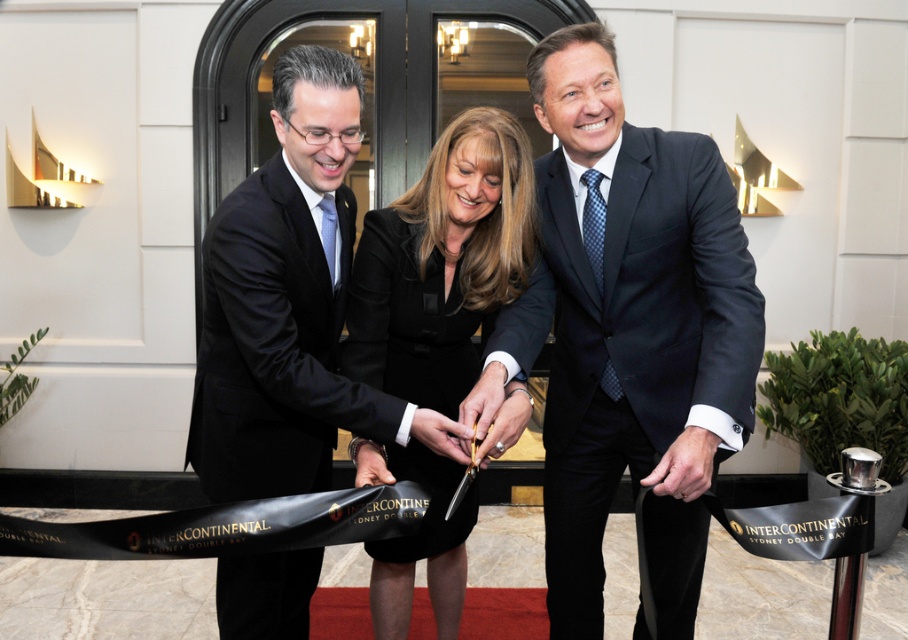
Can you confirm if black silk dress at center is positioned below black satin suit at center?

No.

Is point (624, 253) positioned before point (272, 177)?

No, it is behind (272, 177).

Identify the location of black silk dress at center. This screenshot has width=908, height=640. (637, 330).

Is the position of dark blue textured suit at center less distant than that of black satin dress at center?

Yes, it is.

Does dark blue textured suit at center have a greater width compared to black satin dress at center?

Indeed, dark blue textured suit at center has a greater width compared to black satin dress at center.

Which is behind, point (607, 282) or point (438, 294)?

The point (438, 294) is behind.

I want to click on dark blue textured suit at center, so click(637, 337).

In the scene shown: Is black silk dress at center smaller than dark blue textured suit at center?

Actually, black silk dress at center might be larger than dark blue textured suit at center.

Between black silk dress at center and dark blue textured suit at center, which one appears on the left side from the viewer's perspective?

black silk dress at center

I want to click on black silk dress at center, so click(637, 330).

The height and width of the screenshot is (640, 908). What are the coordinates of `black silk dress at center` in the screenshot? It's located at (637, 330).